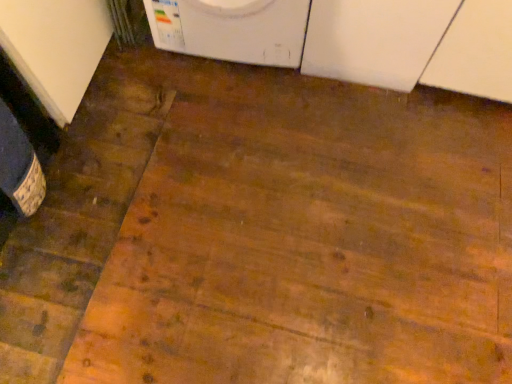
Where is `white glossy washing machine at upper right`? white glossy washing machine at upper right is located at coordinates (374, 40).

What do you see at coordinates (374, 40) in the screenshot? I see `white glossy washing machine at upper right` at bounding box center [374, 40].

This screenshot has width=512, height=384. Find the location of `white glossy washing machine at upper right`. white glossy washing machine at upper right is located at coordinates (374, 40).